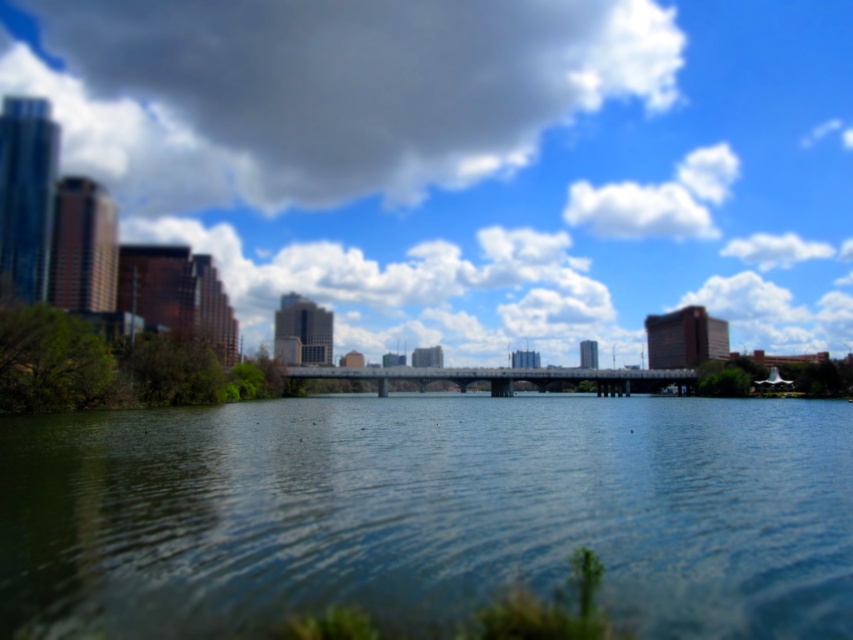
You are an architect designing a new observation deck that needs to have a clear view of both the blue sky at upper center and the blue water at center. Based on the scene described, can you confirm if these two elements are visible from the same vantage point?

Yes, the blue sky at upper center is positioned over the blue water at center, meaning they are aligned vertically. This allows both elements to be visible simultaneously from the same vantage point without obstruction.

You are a photographer planning to capture a wide shot of the blue water at center and the white fluffy cloud at upper center. Given that your camera can focus on objects up to 200 meters away, will you be able to capture both subjects clearly in one shot?

The distance between the blue water at center and the white fluffy cloud at upper center is 235.64 meters. Since your camera can only focus up to 200 meters, the cloud is beyond the camera range. Therefore, you cannot capture both clearly in one shot.